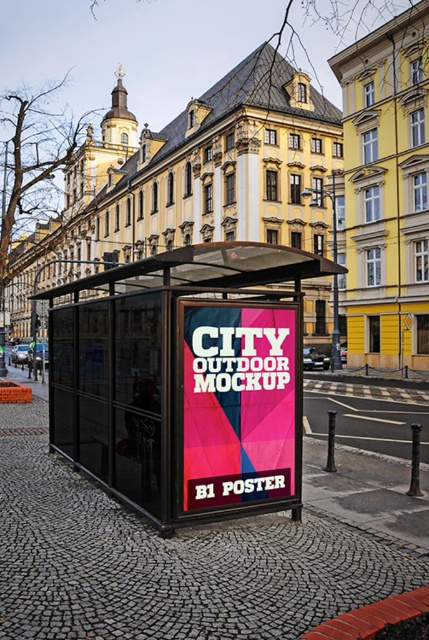
You are standing at the entrance of the bus stop and want to take a photo of the metallic glass bus stop at center. Where should you position yourself to capture the entire structure in your camera frame?

Position yourself at the entrance of the bus stop and aim your camera towards the center point at coordinates approximately 0.595 on the x and 0.434 on the y axis to capture the entire metallic glass bus stop at center in your frame.

You are standing at the bus stop and want to locate the point marked as point (186, 380). Where exactly would you find this point in relation to the metallic glass bus stop at center?

The point (186, 380) is on the metallic glass bus stop at center.